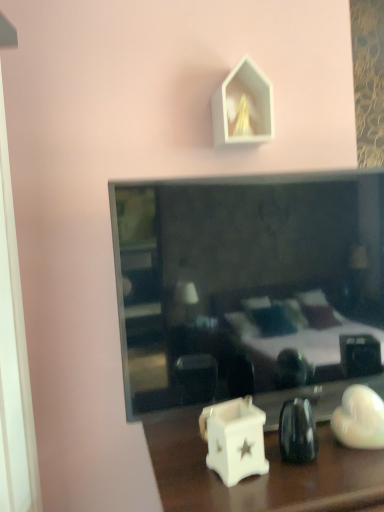
Question: Choose the correct answer: Is smooth glass mirror at center inside white glossy candle holder at lower center or outside it?

Choices:
 (A) inside
 (B) outside

Answer: (B)

Question: Looking at the image, does smooth glass mirror at center seem bigger or smaller compared to white glossy candle holder at lower center?

Choices:
 (A) small
 (B) big

Answer: (A)

Question: Which object is the closest to the smooth glass mirror at center?

Choices:
 (A) white glossy candle holder at lower center
 (B) white ceramic candle holder at lower center
 (C) white matte house-shaped object at upper center

Answer: (A)

Question: Considering the real-world distances, which object is closest to the white glossy candle holder at lower center?

Choices:
 (A) white ceramic candle holder at lower center
 (B) smooth glass mirror at center
 (C) white matte house-shaped object at upper center

Answer: (A)